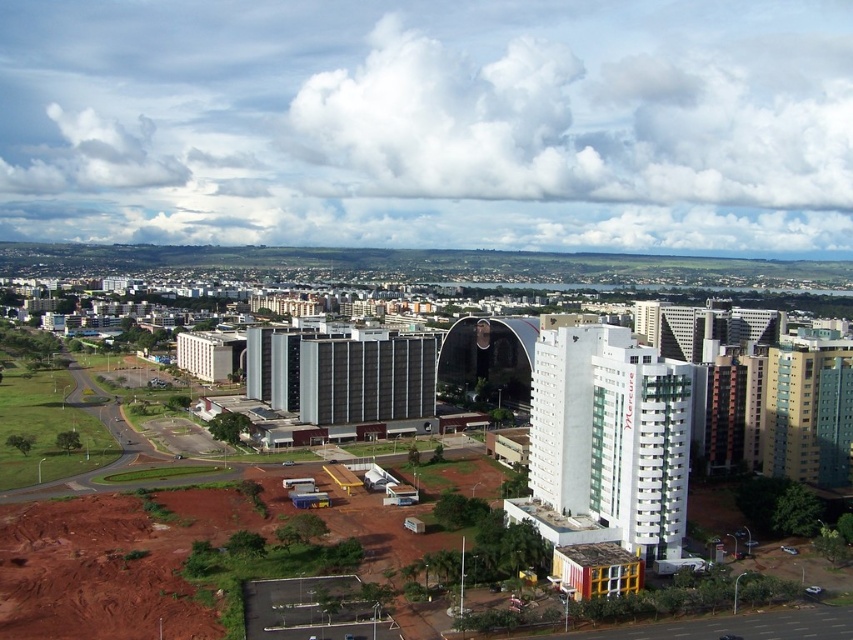
Between white smooth building at center and metallic gray building at center, which one appears on the left side from the viewer's perspective?

metallic gray building at center

Is point (544, 506) positioned in front of point (375, 387)?

Yes, it is in front of point (375, 387).

This screenshot has width=853, height=640. What are the coordinates of `white smooth building at center` in the screenshot? It's located at (611, 435).

The width and height of the screenshot is (853, 640). What do you see at coordinates (341, 372) in the screenshot? I see `metallic gray building at center` at bounding box center [341, 372].

Which is above, metallic gray building at center or white smooth building at center-left?

Positioned higher is white smooth building at center-left.

Is point (363, 336) positioned behind point (213, 362)?

No, it is in front of (213, 362).

Locate an element on the screen. The height and width of the screenshot is (640, 853). metallic gray building at center is located at coordinates point(341,372).

Can you confirm if white smooth building at center is bigger than white smooth building at center-left?

Actually, white smooth building at center might be smaller than white smooth building at center-left.

This screenshot has height=640, width=853. Find the location of `white smooth building at center`. white smooth building at center is located at coordinates (611, 435).

Identify the location of white smooth building at center. (611, 435).